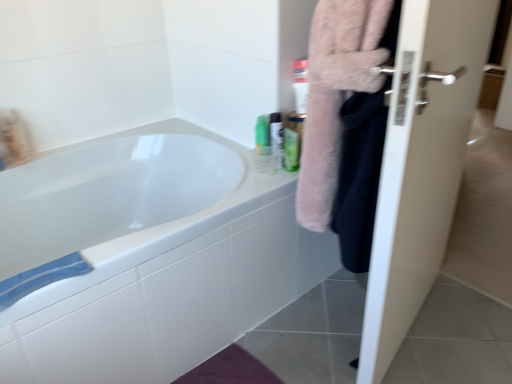
Question: Is white glossy mouthwash at upper right, which appears as the 3th mouthwash when viewed from the left, far away from translucent plastic mouthwash at upper left, acting as the fourth mouthwash starting from the right?

Choices:
 (A) yes
 (B) no

Answer: (B)

Question: Is white glossy mouthwash at upper right, acting as the 2th mouthwash starting from the right, behind translucent plastic mouthwash at upper left, arranged as the first mouthwash when viewed from the left?

Choices:
 (A) yes
 (B) no

Answer: (B)

Question: Is white glossy mouthwash at upper right, acting as the 2th mouthwash starting from the right, not inside translucent plastic mouthwash at upper left, acting as the fourth mouthwash starting from the right?

Choices:
 (A) yes
 (B) no

Answer: (A)

Question: Does white glossy mouthwash at upper right, acting as the 2th mouthwash starting from the right, have a lesser width compared to translucent plastic mouthwash at upper left, arranged as the first mouthwash when viewed from the left?

Choices:
 (A) yes
 (B) no

Answer: (A)

Question: Does white glossy mouthwash at upper right, acting as the 2th mouthwash starting from the right, come in front of translucent plastic mouthwash at upper left, acting as the fourth mouthwash starting from the right?

Choices:
 (A) yes
 (B) no

Answer: (A)

Question: Considering the relative positions of white glossy mouthwash at upper right, which appears as the 3th mouthwash when viewed from the left, and translucent plastic mouthwash at upper left, arranged as the first mouthwash when viewed from the left, in the image provided, is white glossy mouthwash at upper right, which appears as the 3th mouthwash when viewed from the left, to the right of translucent plastic mouthwash at upper left, arranged as the first mouthwash when viewed from the left, from the viewer's perspective?

Choices:
 (A) no
 (B) yes

Answer: (B)

Question: From the image's perspective, is white glossy bathtub at upper left on top of green matte bottle at upper right, placed as the fourth mouthwash when sorted from left to right?

Choices:
 (A) yes
 (B) no

Answer: (B)

Question: From a real-world perspective, is white glossy bathtub at upper left positioned under green matte bottle at upper right, placed as the fourth mouthwash when sorted from left to right, based on gravity?

Choices:
 (A) no
 (B) yes

Answer: (B)

Question: Does white glossy bathtub at upper left have a greater width compared to green matte bottle at upper right, placed as the fourth mouthwash when sorted from left to right?

Choices:
 (A) yes
 (B) no

Answer: (A)

Question: Is white glossy bathtub at upper left in front of green matte bottle at upper right, placed as the fourth mouthwash when sorted from left to right?

Choices:
 (A) no
 (B) yes

Answer: (B)

Question: Considering the relative sizes of white glossy bathtub at upper left and green matte bottle at upper right, the first mouthwash from the right, in the image provided, is white glossy bathtub at upper left taller than green matte bottle at upper right, the first mouthwash from the right,?

Choices:
 (A) yes
 (B) no

Answer: (A)

Question: Is white glossy bathtub at upper left to the right of green matte bottle at upper right, placed as the fourth mouthwash when sorted from left to right, from the viewer's perspective?

Choices:
 (A) no
 (B) yes

Answer: (A)

Question: From a real-world perspective, is white glossy door at right on top of white glossy mouthwash at upper right, acting as the 2th mouthwash starting from the right?

Choices:
 (A) yes
 (B) no

Answer: (B)